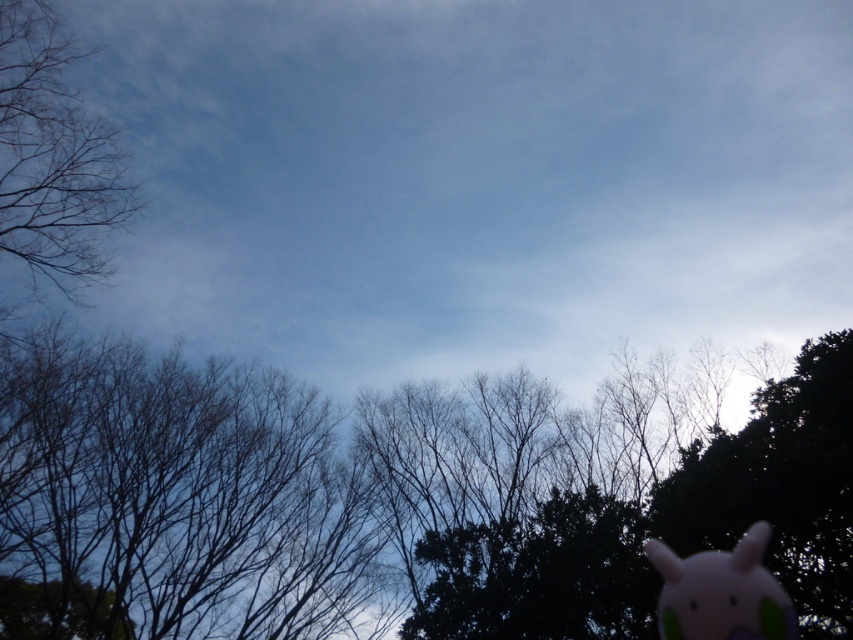
Question: In this image, where is green leafy tree at center located relative to pink plush toy at lower right?

Choices:
 (A) right
 (B) left

Answer: (B)

Question: Does bare branches at left have a lesser width compared to pink plush toy at lower right?

Choices:
 (A) yes
 (B) no

Answer: (A)

Question: Is bare branches at left to the right of pink plush toy at lower right from the viewer's perspective?

Choices:
 (A) yes
 (B) no

Answer: (B)

Question: Which point is farther from the camera taking this photo?

Choices:
 (A) (78, 145)
 (B) (692, 616)
 (C) (126, 632)

Answer: (C)

Question: Which is farther from the bare branches at left?

Choices:
 (A) pink plush toy at lower right
 (B) green leafy tree at center

Answer: (A)

Question: Among these objects, which one is farthest from the camera?

Choices:
 (A) pink plush toy at lower right
 (B) bare branches at left
 (C) green leafy tree at center

Answer: (B)